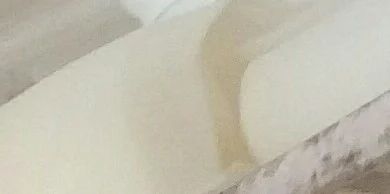
Where is `divider`? The height and width of the screenshot is (194, 390). divider is located at coordinates (327, 169).